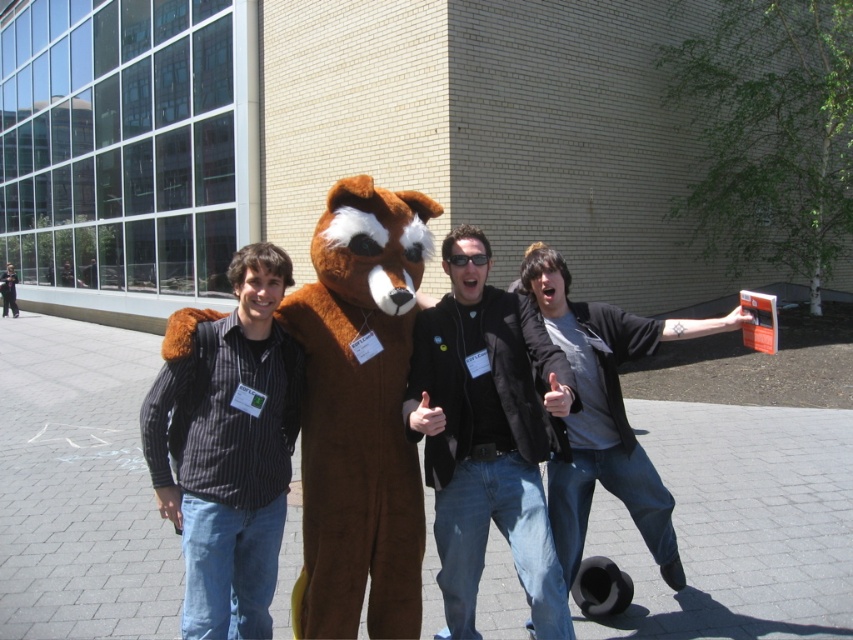
Is point (367, 548) positioned behind point (646, 348)?

No, (367, 548) is closer to viewer.

Between brown furry mascot at center and gray cotton shirt at center, which one appears on the right side from the viewer's perspective?

From the viewer's perspective, gray cotton shirt at center appears more on the right side.

Locate an element on the screen. This screenshot has height=640, width=853. brown furry mascot at center is located at coordinates (360, 412).

Where is `brown furry mascot at center`? Image resolution: width=853 pixels, height=640 pixels. brown furry mascot at center is located at coordinates click(x=360, y=412).

This screenshot has width=853, height=640. What are the coordinates of `gray cotton shirt at center` in the screenshot? It's located at (602, 413).

Does brown furry mascot at center have a lesser height compared to black leather jacket at center?

Correct, brown furry mascot at center is not as tall as black leather jacket at center.

Which is more to the right, brown furry mascot at center or black leather jacket at center?

black leather jacket at center

Which is behind, point (306, 611) or point (463, 244)?

The point (463, 244) is more distant.

Where is `brown furry mascot at center`? Image resolution: width=853 pixels, height=640 pixels. brown furry mascot at center is located at coordinates (360, 412).